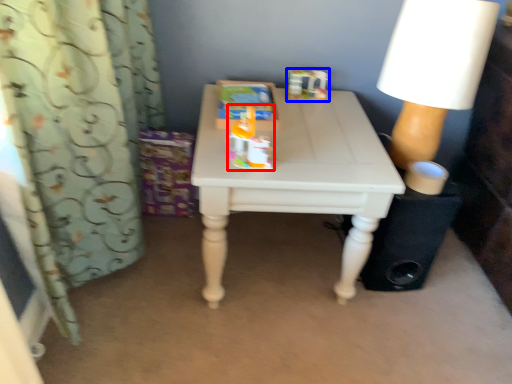
Question: Which object appears closest to the camera in this image, toy (highlighted by a red box) or toy (highlighted by a blue box)?

Choices:
 (A) toy
 (B) toy

Answer: (A)